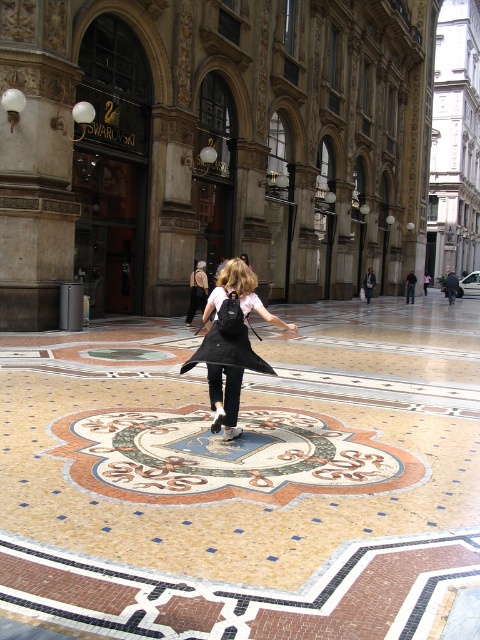
Question: Among these objects, which one is nearest to the camera?

Choices:
 (A) black matte backpack at center
 (B) black matte dress at center

Answer: (A)

Question: Does black matte backpack at center have a lesser width compared to black matte dress at center?

Choices:
 (A) yes
 (B) no

Answer: (A)

Question: Is black matte backpack at center above black matte dress at center?

Choices:
 (A) no
 (B) yes

Answer: (A)

Question: Among these points, which one is nearest to the camera?

Choices:
 (A) (222, 332)
 (B) (241, 291)

Answer: (A)

Question: Does black matte backpack at center appear on the right side of black matte dress at center?

Choices:
 (A) yes
 (B) no

Answer: (A)